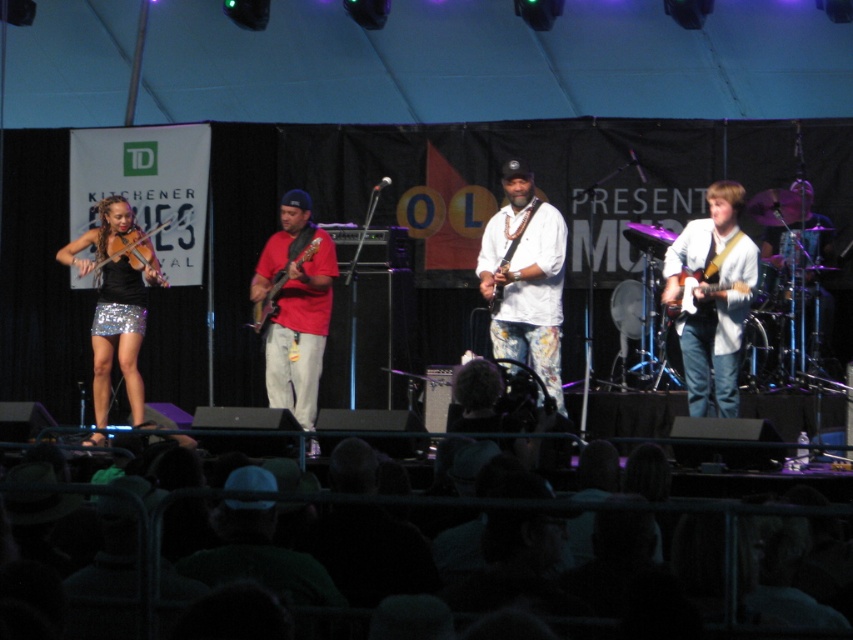
Between red matte guitar at center and white glossy guitar at right, which one is positioned lower?

red matte guitar at center is below.

Is point (274, 364) less distant than point (744, 285)?

No, it is not.

Does point (276, 333) come farther from viewer compared to point (698, 285)?

Yes, it is.

The image size is (853, 640). Find the location of `red matte guitar at center`. red matte guitar at center is located at coordinates (294, 308).

Between matte red guitar at center and white glossy guitar at center, which one appears on the right side from the viewer's perspective?

From the viewer's perspective, white glossy guitar at center appears more on the right side.

Who is positioned more to the left, matte red guitar at center or white glossy guitar at center?

matte red guitar at center

The height and width of the screenshot is (640, 853). Find the location of `matte red guitar at center`. matte red guitar at center is located at coordinates (268, 301).

Locate an element on the screen. matte red guitar at center is located at coordinates (268, 301).

Does matte red guitar at center have a lesser height compared to shiny black violin at left?

No.

Which of these two, matte red guitar at center or shiny black violin at left, stands taller?

With more height is matte red guitar at center.

Is point (254, 328) more distant than point (136, 259)?

No, (254, 328) is in front of (136, 259).

Where is `matte red guitar at center`? The width and height of the screenshot is (853, 640). matte red guitar at center is located at coordinates (268, 301).